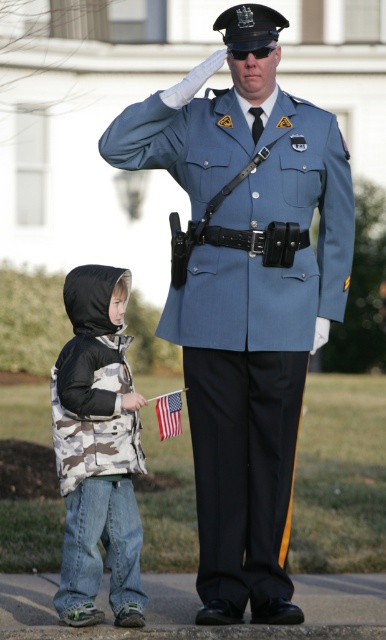
Question: Is blue uniform at center wider than camouflage fabric vest at lower left?

Choices:
 (A) no
 (B) yes

Answer: (B)

Question: Does blue uniform at center appear over camouflage fabric vest at lower left?

Choices:
 (A) no
 (B) yes

Answer: (B)

Question: Which point appears closest to the camera in this image?

Choices:
 (A) (255, 244)
 (B) (103, 467)

Answer: (B)

Question: Which object appears farthest from the camera in this image?

Choices:
 (A) american flag at lower center
 (B) blue uniform at center
 (C) camouflage fabric vest at lower left

Answer: (A)

Question: Which object is positioned farthest from the camouflage fabric vest at lower left?

Choices:
 (A) blue uniform at center
 (B) american flag at lower center

Answer: (A)

Question: Is camouflage fabric vest at lower left to the right of american flag at lower center from the viewer's perspective?

Choices:
 (A) yes
 (B) no

Answer: (B)